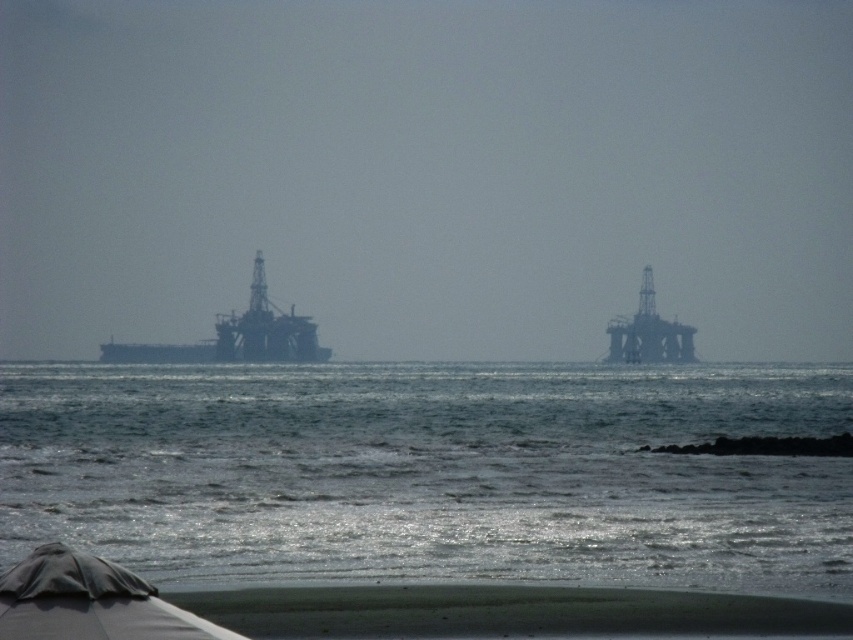
Based on the photo, you are standing on the beach and want to take a photo of the dark gray metallic oil rig at left. However, the gray fabric umbrella at lower left is blocking your view. Is the umbrella between you and the oil rig, or behind the oil rig?

The gray fabric umbrella at lower left is in front of dark gray metallic oil rig at left, so the umbrella is between you and the oil rig.